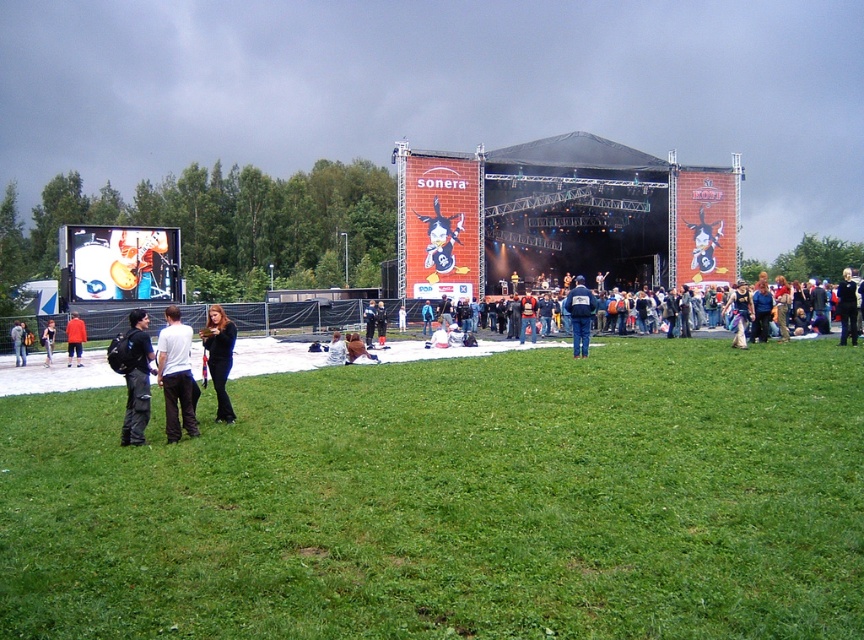
The image size is (864, 640). In order to click on white cotton shirt at center in this screenshot , I will do `click(175, 374)`.

Who is more distant from viewer, (169, 376) or (367, 332)?

Point (367, 332)

At what (x,y) coordinates should I click in order to perform the action: click on white cotton shirt at center. Please return your answer as a coordinate pair (x, y). The width and height of the screenshot is (864, 640). Looking at the image, I should click on (175, 374).

Which is more to the left, black leather jacket at lower left or dark blue jeans at lower left?

From the viewer's perspective, dark blue jeans at lower left appears more on the left side.

This screenshot has width=864, height=640. What do you see at coordinates (219, 356) in the screenshot?
I see `black leather jacket at lower left` at bounding box center [219, 356].

Which is in front, point (218, 310) or point (49, 342)?

Positioned in front is point (218, 310).

What are the coordinates of `black leather jacket at lower left` in the screenshot? It's located at (219, 356).

Which is in front, point (175, 305) or point (68, 328)?

Positioned in front is point (68, 328).

Which of these two, white cotton shirt at center or orange jacket at lower left, stands shorter?

orange jacket at lower left

The image size is (864, 640). Find the location of `white cotton shirt at center`. white cotton shirt at center is located at coordinates (175, 374).

At what (x,y) coordinates should I click in order to perform the action: click on white cotton shirt at center. Please return your answer as a coordinate pair (x, y). This screenshot has width=864, height=640. Looking at the image, I should click on 175,374.